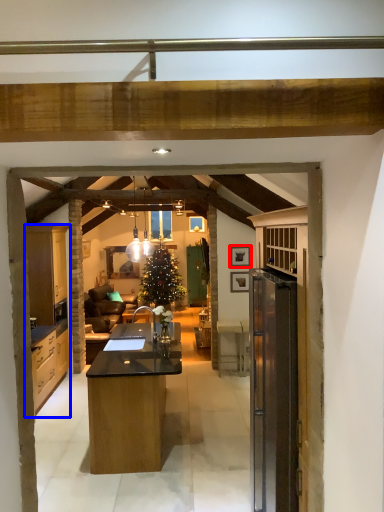
Question: Which object is closer to the camera taking this photo, picture frame (highlighted by a red box) or cabinetry (highlighted by a blue box)?

Choices:
 (A) picture frame
 (B) cabinetry

Answer: (B)